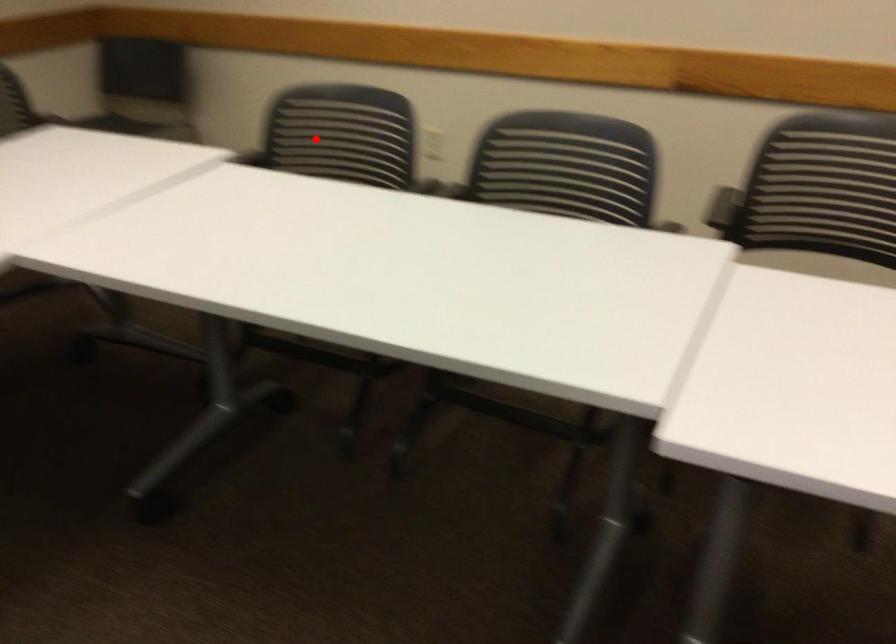
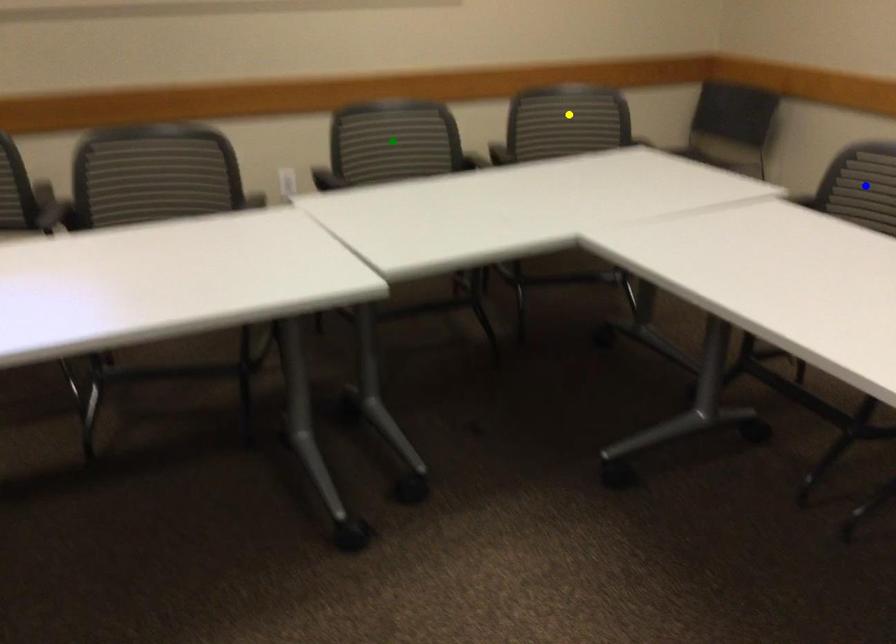
Question: I am providing you with two images of the same scene from different viewpoints. A red point is marked on the first image. You are given multiple points on the second image. Which point in image 2 is actually the same real-world point as the red point in image 1?

Choices:
 (A) blue point
 (B) green point
 (C) yellow point

Answer: (A)